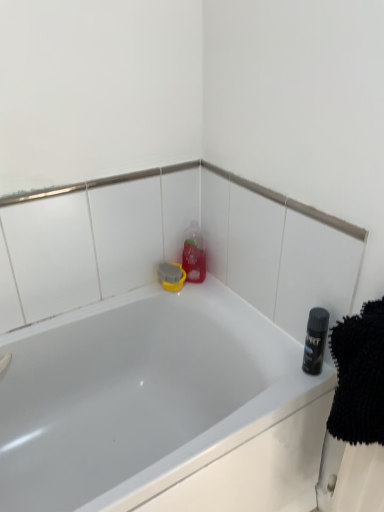
Question: From the image's perspective, relative to white glossy bathtub at center, is shiny black can at right above or below?

Choices:
 (A) above
 (B) below

Answer: (A)

Question: Considering the positions of shiny black can at right and white glossy bathtub at center in the image, is shiny black can at right bigger or smaller than white glossy bathtub at center?

Choices:
 (A) small
 (B) big

Answer: (A)

Question: Which object is the farthest from the translucent plastic bottle at upper center?

Choices:
 (A) white glossy bathtub at center
 (B) shiny black can at right

Answer: (B)

Question: Which is farther from the white glossy bathtub at center?

Choices:
 (A) translucent plastic bottle at upper center
 (B) shiny black can at right

Answer: (B)